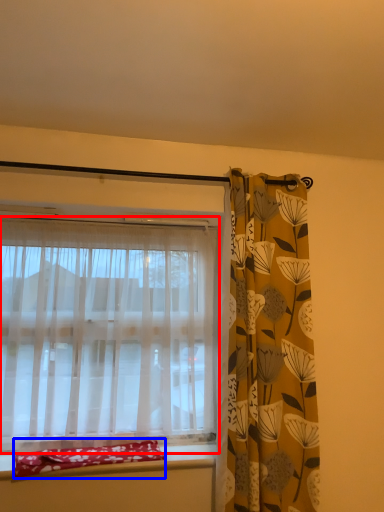
Question: Among these objects, which one is farthest to the camera, curtain (highlighted by a red box) or material (highlighted by a blue box)?

Choices:
 (A) curtain
 (B) material

Answer: (A)